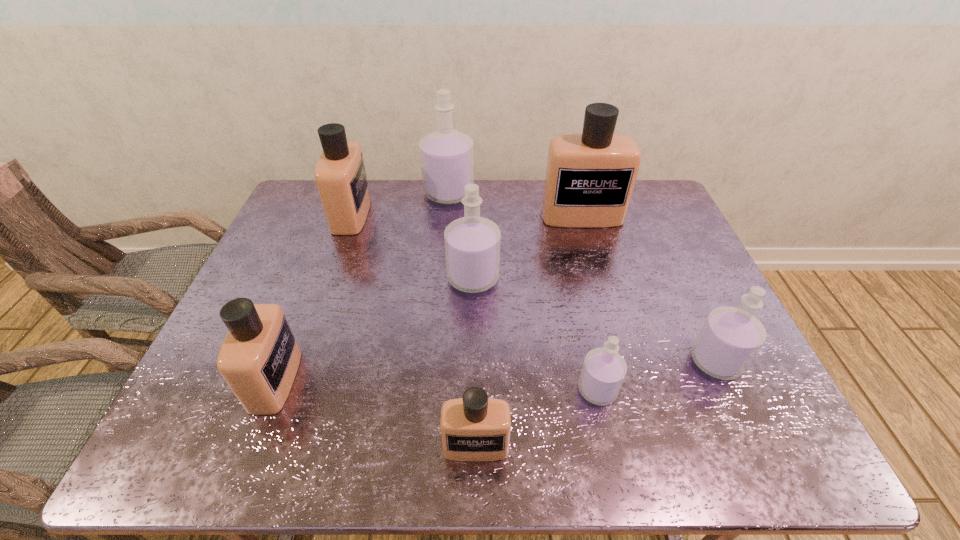
Where is `the second beige perfume from right to left`? the second beige perfume from right to left is located at coordinates (474, 428).

The height and width of the screenshot is (540, 960). I want to click on vacant space located on the front of the biggest purple perfume, so click(x=445, y=228).

Find the location of `vacant space located 0.250m on the front label of the biggest beige perfume`. vacant space located 0.250m on the front label of the biggest beige perfume is located at coordinates (601, 284).

What are the coordinates of `vacant space located 0.320m on the front label of the second biggest beige perfume` in the screenshot? It's located at (466, 215).

I want to click on vacant point located on the left of the third nearest purple perfume, so click(330, 278).

You are a GUI agent. You are given a task and a screenshot of the screen. Output one action in this format:
    pyautogui.click(x=<x>, y=<y>)
    Task: Click on the free region located on the front label of the second nearest beige perfume
    The height and width of the screenshot is (540, 960).
    Given the screenshot: What is the action you would take?
    pyautogui.click(x=427, y=380)

The width and height of the screenshot is (960, 540). In order to click on vacant area situated 0.130m on the front of the rightmost object in this screenshot , I will do `click(751, 438)`.

At what (x,y) coordinates should I click in order to perform the action: click on free spot located 0.130m on the left of the third purple perfume from left to right. Please return your answer as a coordinate pair (x, y). This screenshot has width=960, height=540. Looking at the image, I should click on (519, 390).

Where is `object located in the near edge section of the desktop`? This screenshot has width=960, height=540. object located in the near edge section of the desktop is located at coordinates (474, 428).

The image size is (960, 540). Find the location of `object positioned at the right edge`. object positioned at the right edge is located at coordinates coord(730,338).